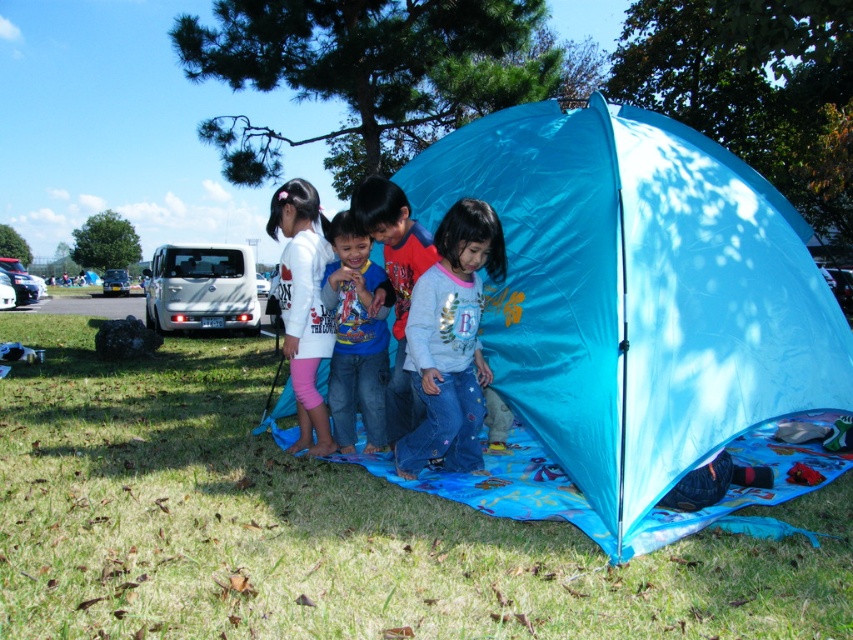
Consider the image. Does blue tarpaulin tent at center come in front of white matte shirt at center?

Yes, it is in front of white matte shirt at center.

Is blue tarpaulin tent at center smaller than white matte shirt at center?

Incorrect, blue tarpaulin tent at center is not smaller in size than white matte shirt at center.

This screenshot has height=640, width=853. What do you see at coordinates (631, 310) in the screenshot?
I see `blue tarpaulin tent at center` at bounding box center [631, 310].

Find the location of `blue tarpaulin tent at center`. blue tarpaulin tent at center is located at coordinates (631, 310).

Who is taller, blue tarpaulin tent at center or light blue denim pants at center?

With more height is blue tarpaulin tent at center.

Does point (697, 323) lie behind point (447, 284)?

No, (697, 323) is in front of (447, 284).

The height and width of the screenshot is (640, 853). Identify the location of blue tarpaulin tent at center. (631, 310).

Which is in front, point (489, 211) or point (306, 243)?

Point (489, 211) is more forward.

I want to click on light blue denim pants at center, so click(451, 340).